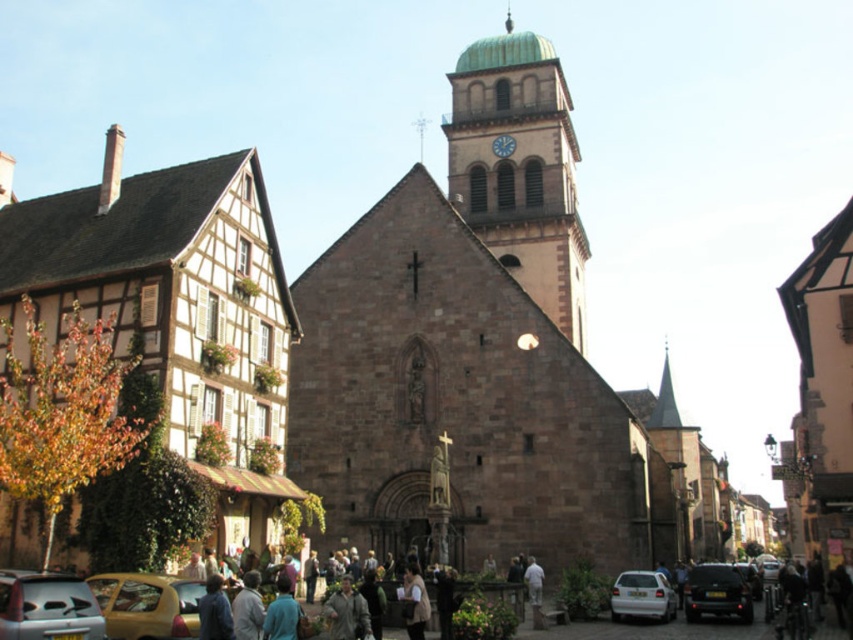
You are standing on the European street and see the gray wool coat at lower center and the metallic clock at upper center. Which object is closer to you?

The gray wool coat at lower center is closer to you because it is in front of the metallic clock at upper center.

Based on the photo, you are standing on a European street looking at the historic church and the half timbered house. There are two points marked on the scene, one at point coordinates point (229, 288) and the other at point coordinates point (660, 616). Which of these two points is closer to you?

Point (229, 288) is closer to you because it is further to the viewer than point (660, 616).